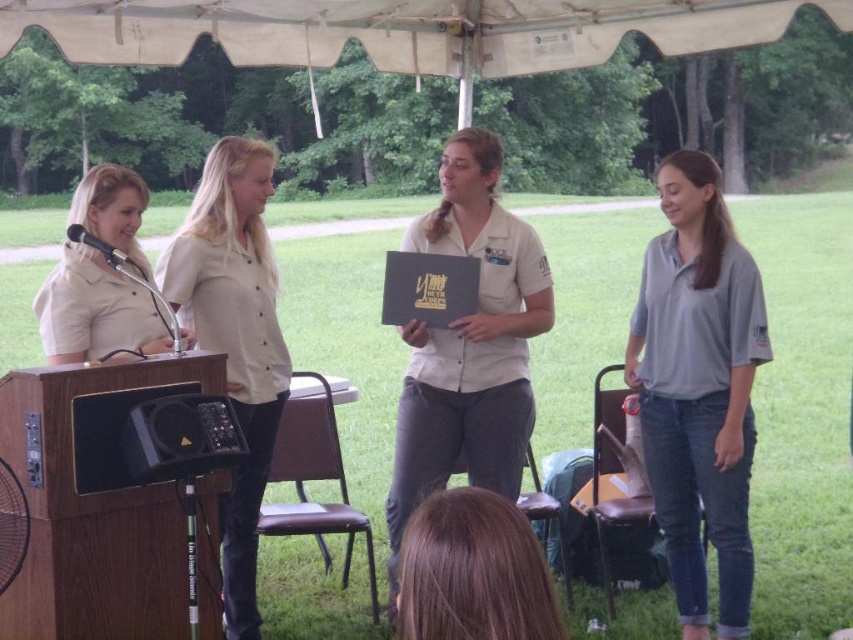
You are a photographer at the event and need to capture a photo where both the brown hair at lower center and the matte black microphone at left are in focus. The camera you are using has a depth of field that can cover objects within a 5.5 feet range. Will both objects be in focus in the photo?

The brown hair at lower center and the matte black microphone at left are 6.08 feet apart, which exceeds the camera depth of field range of 5.5 feet. Therefore, both objects cannot be in focus simultaneously in the photo.

You are attending a community event and notice the brown hair at lower center and the matte black microphone at left. Which object is positioned lower in the image?

The brown hair at lower center is positioned lower than the matte black microphone at left.